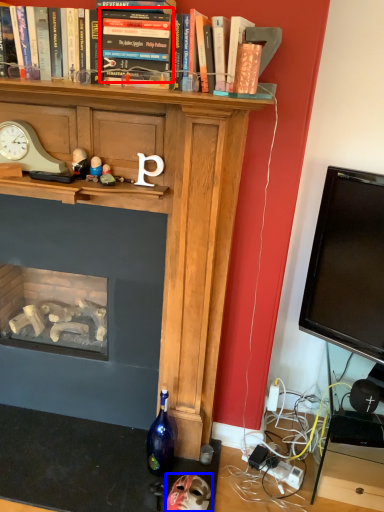
Question: Which object appears closest to the camera in this image, book (highlighted by a red box) or toy (highlighted by a blue box)?

Choices:
 (A) book
 (B) toy

Answer: (A)